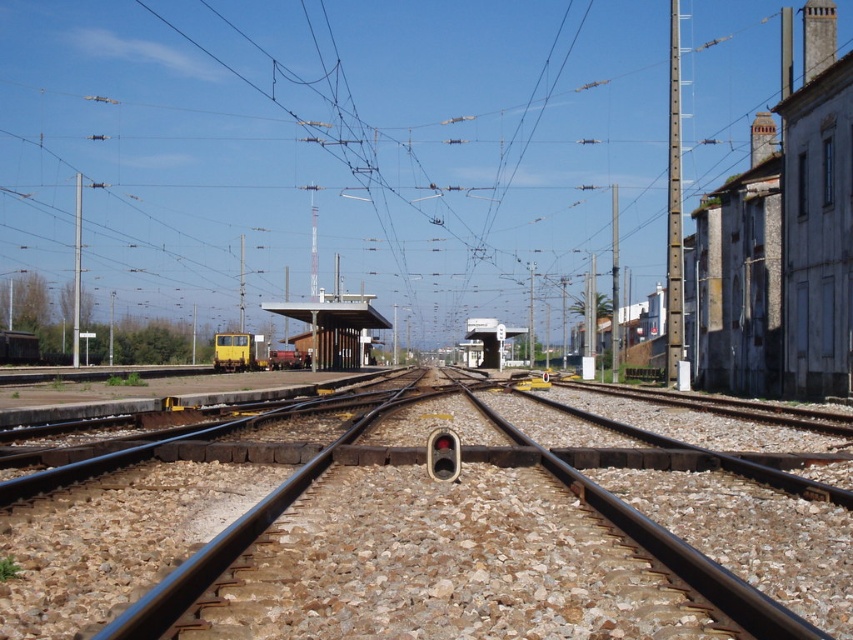
Does white concrete platform at center appear over white plastic railway station at center?

Yes.

Does white concrete platform at center appear on the right side of white plastic railway station at center?

In fact, white concrete platform at center is to the left of white plastic railway station at center.

Does point (311, 301) come closer to viewer compared to point (482, 333)?

That is False.

Image resolution: width=853 pixels, height=640 pixels. Identify the location of white concrete platform at center. (334, 326).

Which is behind, point (463, 618) or point (485, 349)?

The point (485, 349) is behind.

Does metal at center have a larger size compared to white plastic railway station at center?

Actually, metal at center might be smaller than white plastic railway station at center.

What do you see at coordinates (383, 538) in the screenshot? The width and height of the screenshot is (853, 640). I see `metal at center` at bounding box center [383, 538].

The image size is (853, 640). What are the coordinates of `metal at center` in the screenshot? It's located at (383, 538).

The image size is (853, 640). In order to click on metal at center in this screenshot , I will do `click(383, 538)`.

Does metal at center have a greater width compared to white concrete platform at center?

No, metal at center is not wider than white concrete platform at center.

This screenshot has width=853, height=640. I want to click on metal at center, so click(383, 538).

Where is `metal at center`? Image resolution: width=853 pixels, height=640 pixels. metal at center is located at coordinates (383, 538).